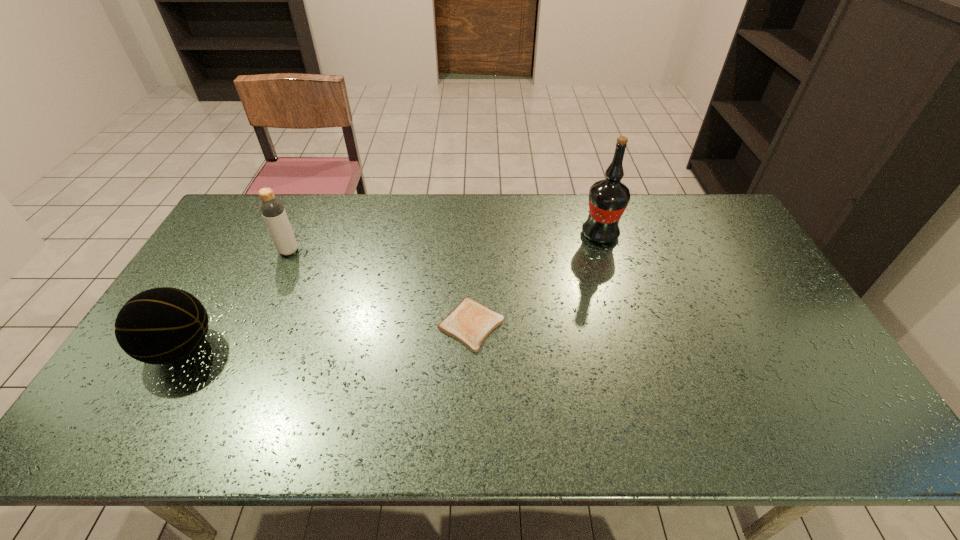
What are the coordinates of `object that is the third closest to the shortest object` in the screenshot? It's located at (163, 325).

Point out which object is positioned as the second nearest to the shortest object. Please provide its 2D coordinates. Your answer should be formatted as a tuple, i.e. [(x, y)], where the tuple contains the x and y coordinates of a point satisfying the conditions above.

[(272, 209)]